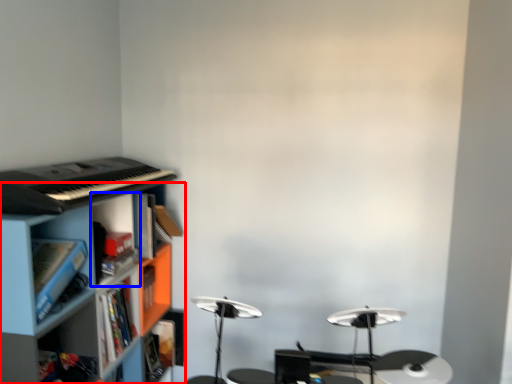
Question: Which object is further to the camera taking this photo, shelf (highlighted by a red box) or cabinet (highlighted by a blue box)?

Choices:
 (A) shelf
 (B) cabinet

Answer: (B)